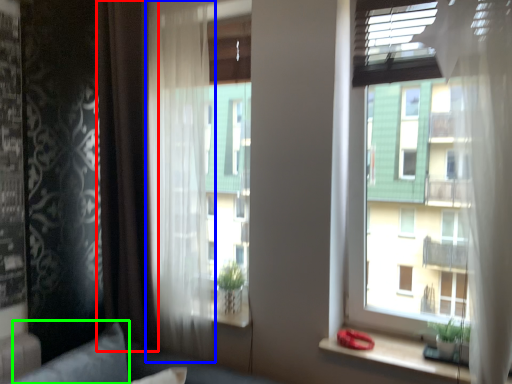
Question: Based on their relative distances, which object is farther from curtain (highlighted by a red box)? Choose from curtain (highlighted by a blue box) and pillow (highlighted by a green box).

Choices:
 (A) curtain
 (B) pillow

Answer: (B)